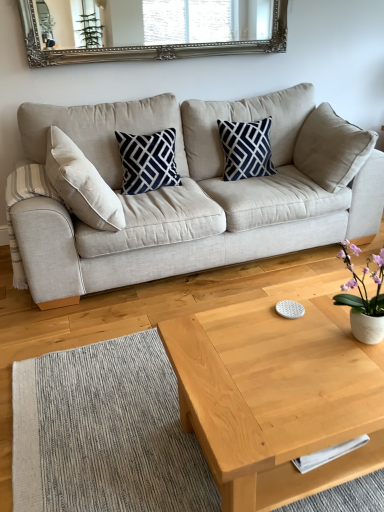
Question: From a real-world perspective, is navy blue/white geometric pillow at center, which is the second pillow in right-to-left order, over light wood/texture coffee table at center?

Choices:
 (A) yes
 (B) no

Answer: (A)

Question: Can you confirm if navy blue/white geometric pillow at center, arranged as the 1th pillow when viewed from the left, is taller than light wood/texture coffee table at center?

Choices:
 (A) no
 (B) yes

Answer: (B)

Question: Is navy blue/white geometric pillow at center, which is the second pillow in right-to-left order, next to light wood/texture coffee table at center?

Choices:
 (A) yes
 (B) no

Answer: (B)

Question: Does navy blue/white geometric pillow at center, arranged as the 1th pillow when viewed from the left, come behind light wood/texture coffee table at center?

Choices:
 (A) no
 (B) yes

Answer: (B)

Question: Considering the relative sizes of navy blue/white geometric pillow at center, arranged as the 1th pillow when viewed from the left, and light wood/texture coffee table at center in the image provided, is navy blue/white geometric pillow at center, arranged as the 1th pillow when viewed from the left, bigger than light wood/texture coffee table at center?

Choices:
 (A) no
 (B) yes

Answer: (A)

Question: Considering the positions of white ceramic vase at right and silver/gilded mirror at upper center in the image, is white ceramic vase at right taller or shorter than silver/gilded mirror at upper center?

Choices:
 (A) tall
 (B) short

Answer: (B)

Question: From a real-world perspective, relative to silver/gilded mirror at upper center, is white ceramic vase at right vertically above or below?

Choices:
 (A) below
 (B) above

Answer: (A)

Question: In terms of size, does white ceramic vase at right appear bigger or smaller than silver/gilded mirror at upper center?

Choices:
 (A) big
 (B) small

Answer: (B)

Question: Do you think white ceramic vase at right is within silver/gilded mirror at upper center, or outside of it?

Choices:
 (A) inside
 (B) outside

Answer: (B)

Question: Does point 332,154 appear closer or farther from the camera than point 175,178?

Choices:
 (A) farther
 (B) closer

Answer: (B)

Question: From a real-world perspective, is beige fabric couch at center physically located above or below navy blue/white geometric pillow at center, which is the second pillow in right-to-left order?

Choices:
 (A) below
 (B) above

Answer: (A)

Question: Do you think beige fabric couch at center is within navy blue/white geometric pillow at center, arranged as the 1th pillow when viewed from the left, or outside of it?

Choices:
 (A) inside
 (B) outside

Answer: (B)

Question: Visually, is beige fabric couch at center positioned to the left or to the right of navy blue/white geometric pillow at center, which is the second pillow in right-to-left order?

Choices:
 (A) right
 (B) left

Answer: (A)

Question: Considering the relative positions of beige fabric couch at center and light wood/texture coffee table at center in the image provided, is beige fabric couch at center to the left or to the right of light wood/texture coffee table at center?

Choices:
 (A) right
 (B) left

Answer: (B)

Question: Is beige fabric couch at center inside the boundaries of light wood/texture coffee table at center, or outside?

Choices:
 (A) outside
 (B) inside

Answer: (A)